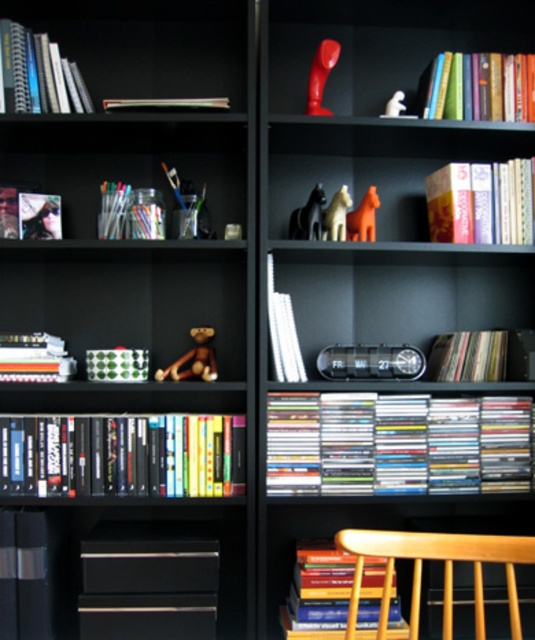
You are organizing a bookshelf and need to place a new book that is 12 inches long. There is space between the matte plastic cds at center and the hardcover book at lower center. Will the new book fit in that space?

The space between the matte plastic cds at center and the hardcover book at lower center is 14.41 inches, so the new book that is 12 inches long will fit in that space.

You are a librarian organizing a bookshelf and need to place a new book. The white matte book at center is located at point (282, 332). If you want to place the new book to the right of the white matte book at center, where should you place it?

You should place the new book to the right of the white matte book at center, which is at point (282, 332). Since the coordinate system is normalized, moving to the right would increase the x value while keeping the y value the same. Therefore, the new position would be approximately point 0.55, 0.529.